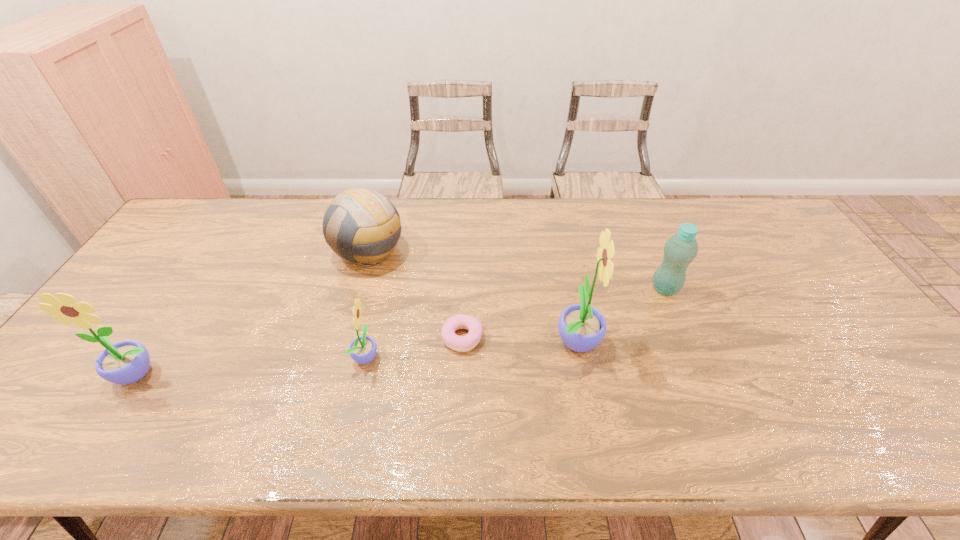
This screenshot has width=960, height=540. Identify the location of vacant space at the far edge of the desktop. (562, 232).

The image size is (960, 540). In order to click on free spot at the near edge of the desktop in this screenshot , I will do `click(292, 404)`.

At what (x,y) coordinates should I click in order to perform the action: click on vacant space at the left edge. Please return your answer as a coordinate pair (x, y). Looking at the image, I should click on (155, 255).

At what (x,y) coordinates should I click in order to perform the action: click on vacant space at the right edge. Please return your answer as a coordinate pair (x, y). Looking at the image, I should click on (763, 260).

The width and height of the screenshot is (960, 540). In order to click on vacant space at the near right corner of the desktop in this screenshot , I will do `click(892, 377)`.

Where is `vacant space that's between the volleyball and the rightmost object`? vacant space that's between the volleyball and the rightmost object is located at coordinates (516, 270).

Identify the location of vacant region between the rightmost object and the volleyball. This screenshot has height=540, width=960. (516, 270).

Image resolution: width=960 pixels, height=540 pixels. What are the coordinates of `vacant point located between the farthest object and the second object from right to left` in the screenshot? It's located at (473, 295).

Where is `blank region between the water bottle and the farthest object`? blank region between the water bottle and the farthest object is located at coordinates (516, 270).

Find the location of a particular element. free space between the farthest object and the leftmost object is located at coordinates 253,313.